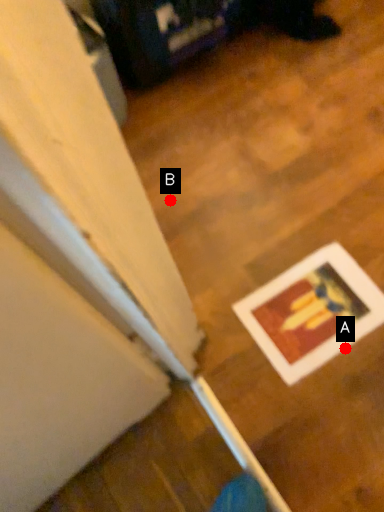
Question: Two points are circled on the image, labeled by A and B beside each circle. Which point appears farthest from the camera in this image?

Choices:
 (A) A is further
 (B) B is further

Answer: (B)